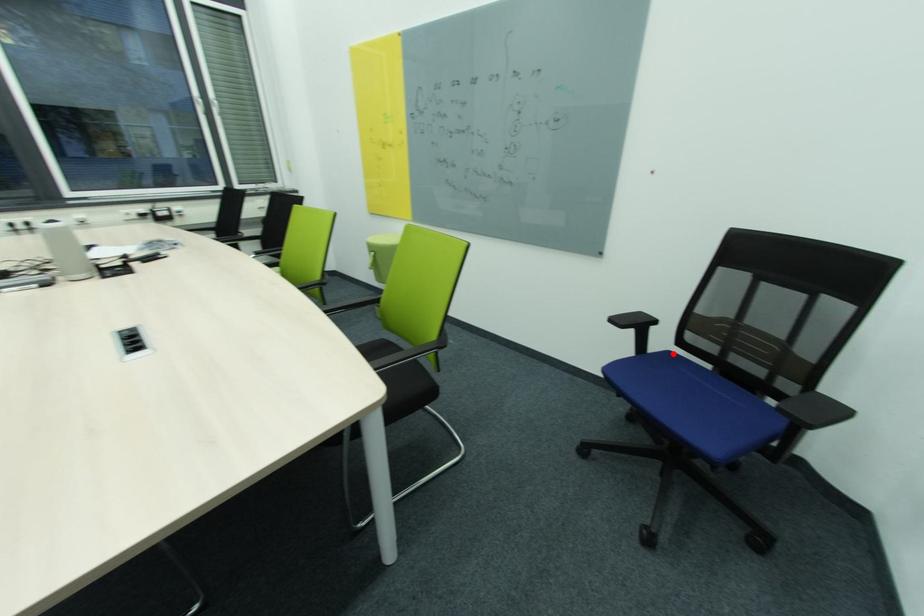
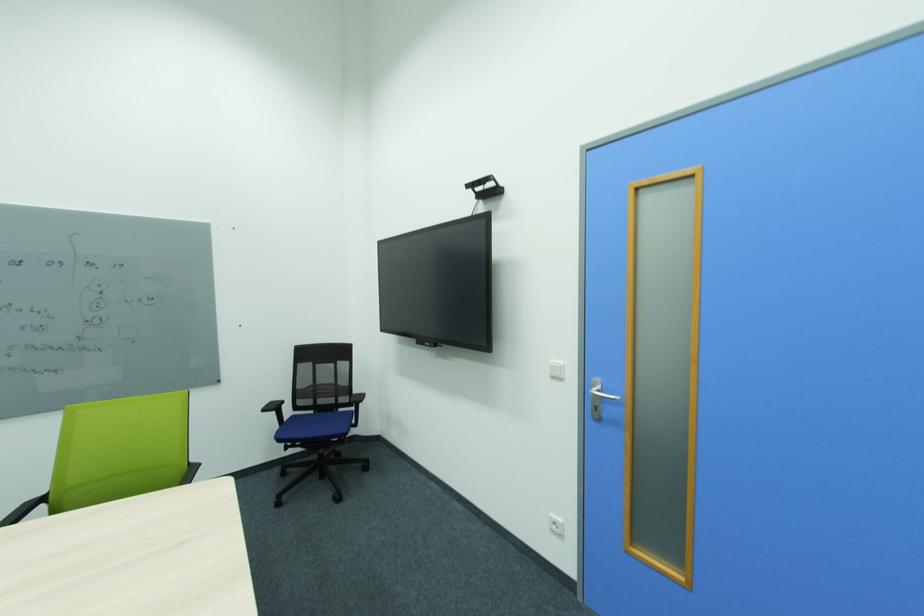
Question: I am providing you with two images of the same scene from different viewpoints. Given a red point in image1, look at the same physical point in image2. Is it:

Choices:
 (A) Closer to the viewpoint
 (B) Farther from the viewpoint

Answer: (B)